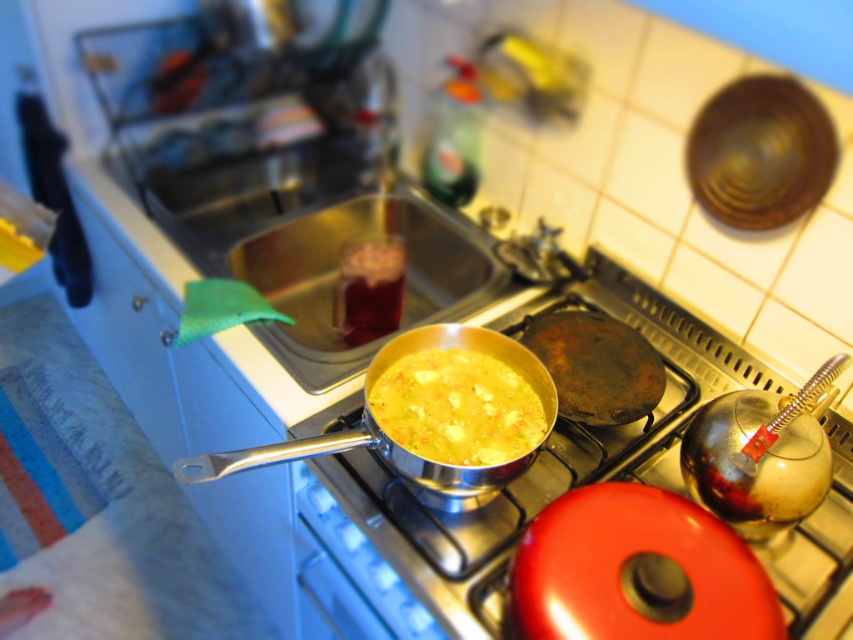
Question: Can you confirm if silver metallic pan at center is wider than yellow matte soup at center?

Choices:
 (A) no
 (B) yes

Answer: (B)

Question: Among these points, which one is farthest from the camera?

Choices:
 (A) (368, 401)
 (B) (338, 563)

Answer: (B)

Question: Is silver metallic pan at center to the left of yellow matte soup at center from the viewer's perspective?

Choices:
 (A) no
 (B) yes

Answer: (A)

Question: Does silver metallic pan at center have a greater width compared to yellow matte soup at center?

Choices:
 (A) no
 (B) yes

Answer: (B)